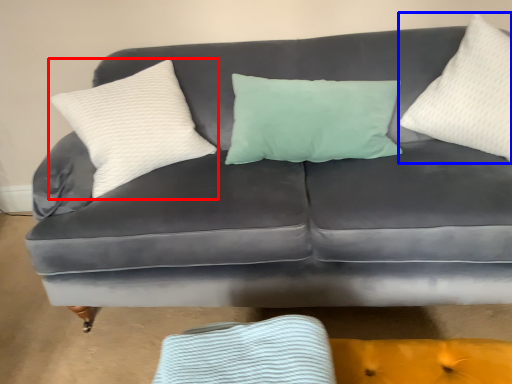
Question: Which object appears closest to the camera in this image, pillow (highlighted by a red box) or pillow (highlighted by a blue box)?

Choices:
 (A) pillow
 (B) pillow

Answer: (B)